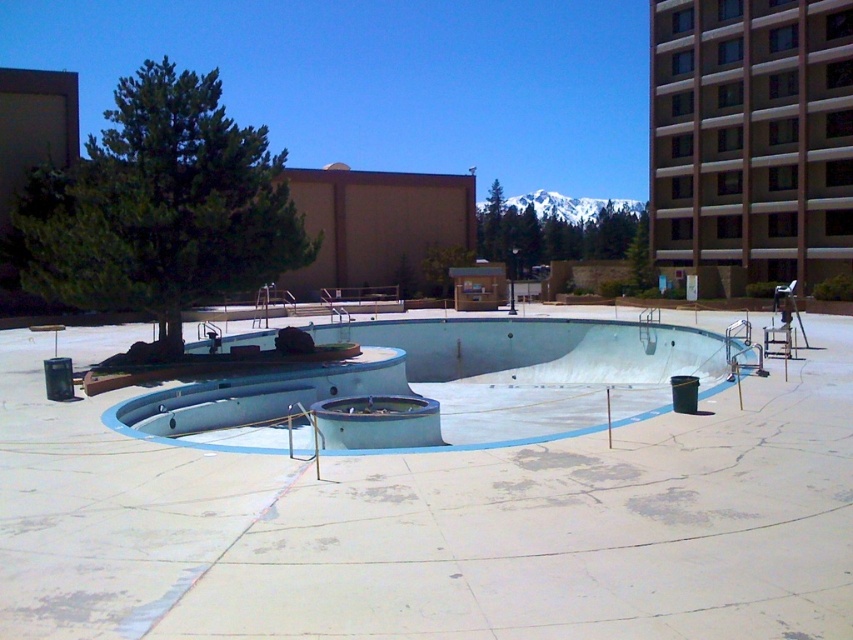
Question: Does smooth concrete skate park at center appear over smooth concrete pool at center?

Choices:
 (A) yes
 (B) no

Answer: (B)

Question: Among these points, which one is nearest to the camera?

Choices:
 (A) (827, 611)
 (B) (213, 403)

Answer: (A)

Question: Is smooth concrete skate park at center to the right of smooth concrete pool at center from the viewer's perspective?

Choices:
 (A) yes
 (B) no

Answer: (A)

Question: Which object appears closest to the camera in this image?

Choices:
 (A) smooth concrete pool at center
 (B) smooth concrete skate park at center

Answer: (B)

Question: Which object appears closest to the camera in this image?

Choices:
 (A) smooth concrete skate park at center
 (B) smooth concrete pool at center

Answer: (A)

Question: Where is smooth concrete skate park at center located in relation to smooth concrete pool at center in the image?

Choices:
 (A) below
 (B) above

Answer: (A)